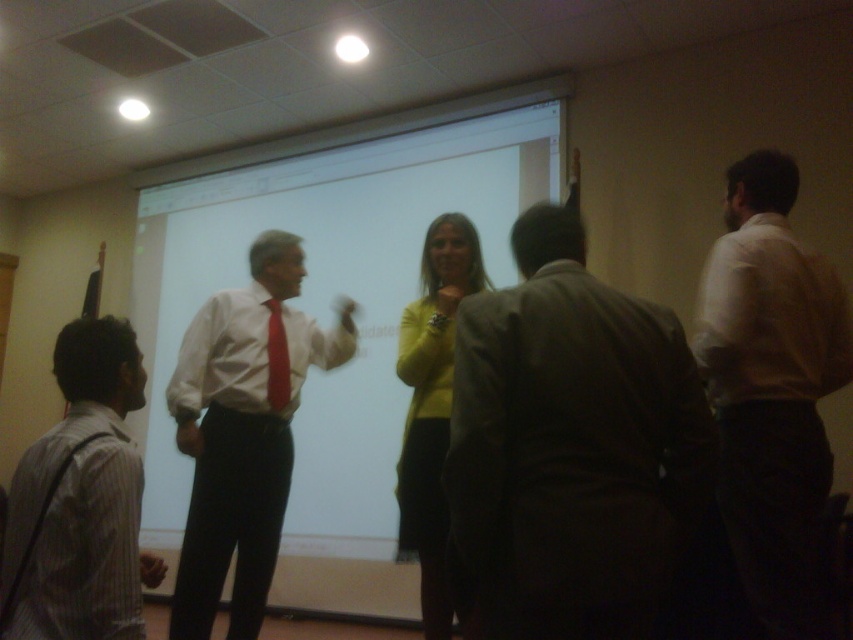
You are attending a meeting in the conference room and notice two attendees wearing the striped cotton shirt at lower left and the yellow sweater at center. If you want to sit between them, which side should you choose to ensure there is enough space?

The striped cotton shirt at lower left might be wider than the yellow sweater at center, so you should sit between them on the side of the yellow sweater at center to have more space.

Based on the photo, you are attending a virtual meeting and see two participants on your screen. The first is wearing a striped cotton shirt at lower left and the second is wearing a yellow sweater at center. Which participant is sitting to the left of the other?

The striped cotton shirt at lower left is positioned on the left side of yellow sweater at center, so the participant in the striped cotton shirt at lower left is sitting to the left of the one in the yellow sweater at center.

You are a photographer positioned at the back of the room. You want to take a photo of both the white smooth shirt at right and the white glossy shirt at center. The camera you are using has a maximum focus range of 5 feet. Can you capture both subjects in focus without moving closer?

The distance between the white smooth shirt at right and the white glossy shirt at center is 5.28 feet. Since the camera can only focus up to 5 feet, the subjects are slightly out of the focus range. You might need to adjust your position or use a different camera setting to ensure both are in focus.